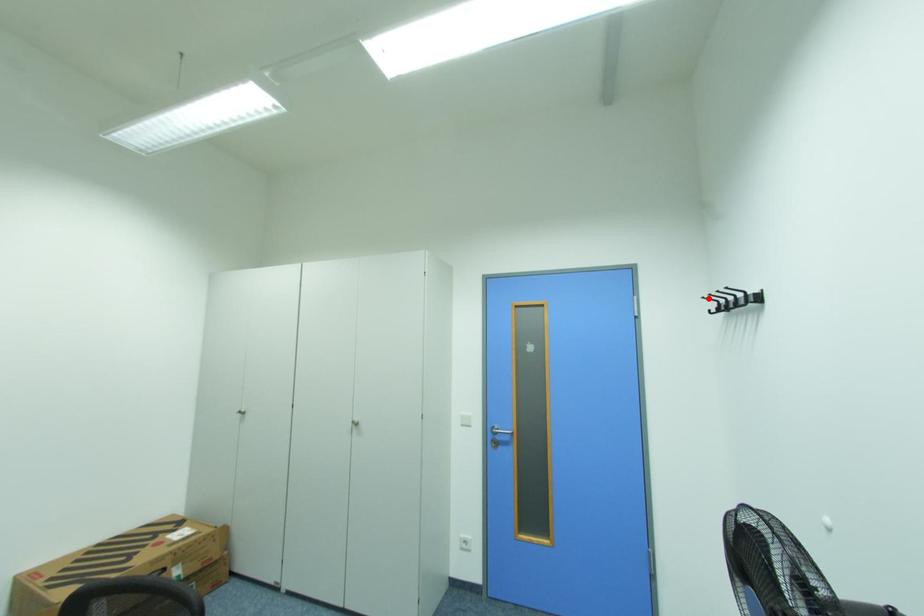
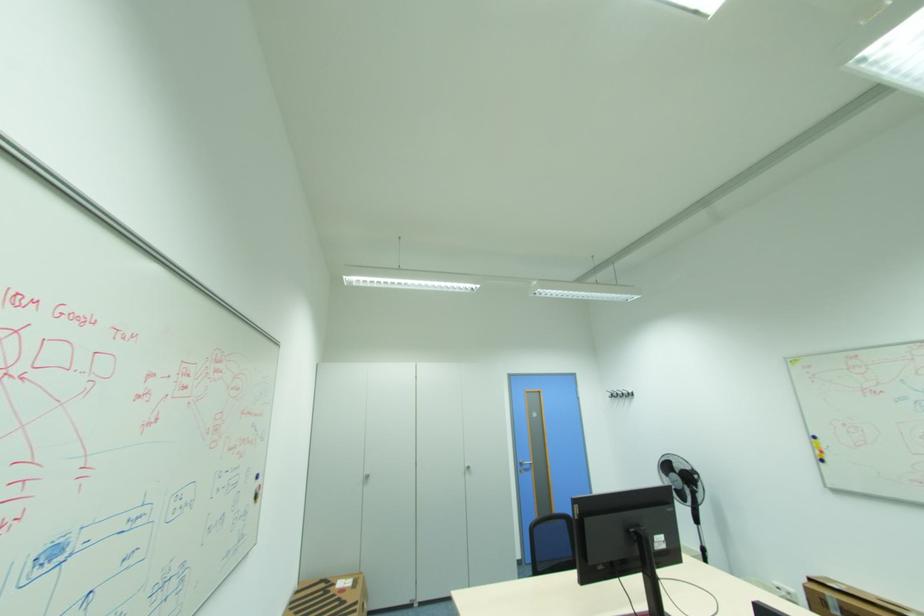
Question: A red point is marked in image1. In image2, is the corresponding 3D point closer to the camera or farther? Reply with the corresponding letter.

Choices:
 (A) The corresponding 3D point is closer.
 (B) The corresponding 3D point is farther.

Answer: (B)